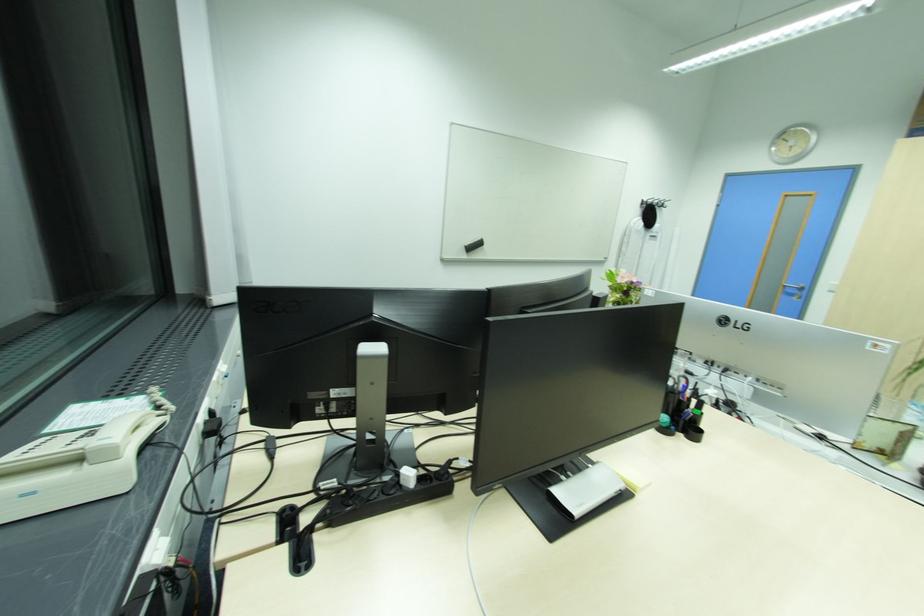
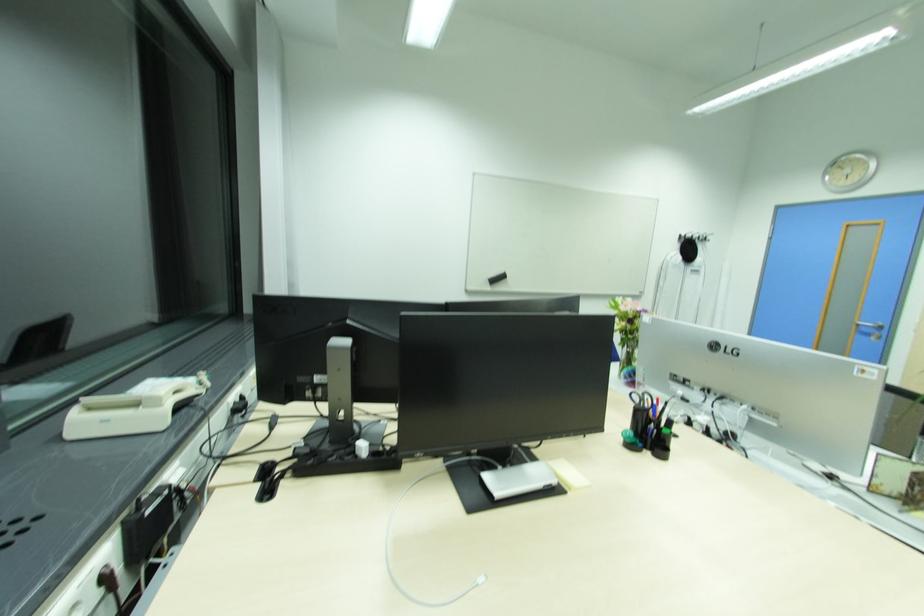
In the second image, find the point that corresponds to (744,326) in the first image.

(734, 351)